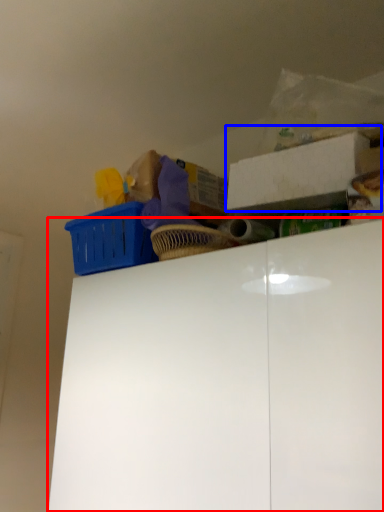
Question: Which point is closer to the camera, cabinetry (highlighted by a red box) or storage box (highlighted by a blue box)?

Choices:
 (A) cabinetry
 (B) storage box

Answer: (A)